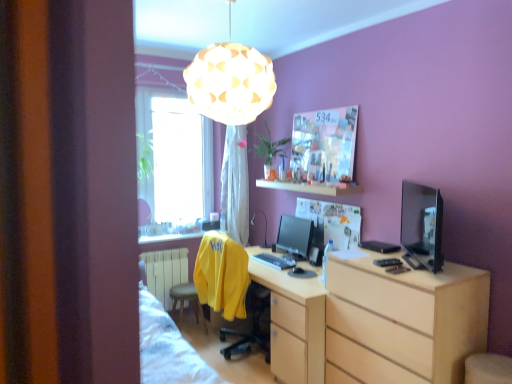
Question: Is point (177, 274) closer or farther from the camera than point (339, 192)?

Choices:
 (A) farther
 (B) closer

Answer: (A)

Question: From a real-world perspective, is white metallic radiator at lower left positioned above or below white glossy shelf at upper center?

Choices:
 (A) below
 (B) above

Answer: (A)

Question: Estimate the real-world distances between objects in this image. Which object is farther from the white glossy shelf at upper center?

Choices:
 (A) satin black monitor at center, which is the 2th computer monitor from right to left
 (B) yellow fabric stool at lower center
 (C) light wood chest of drawers at lower right
 (D) white sheer curtain at center
 (E) matte black desk lamp at center

Answer: (B)

Question: Which object is the closest to the matte black monitor at right, the first computer monitor positioned from the front?

Choices:
 (A) white sheer curtain at center
 (B) satin black monitor at center, the 1th computer monitor viewed from the back
 (C) transparent glass window at upper left
 (D) white metallic radiator at lower left
 (E) yellow fabric stool at lower center

Answer: (B)